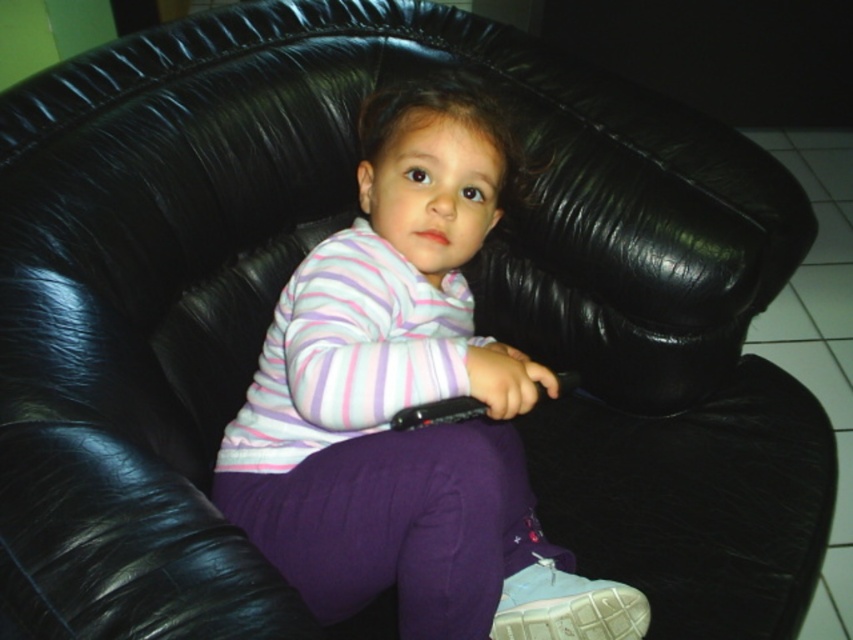
Which is more to the right, striped cotton shirt at center or light blue fabric shoe at lower center?

light blue fabric shoe at lower center

Between striped cotton shirt at center and light blue fabric shoe at lower center, which one has less height?

light blue fabric shoe at lower center is shorter.

You are a GUI agent. You are given a task and a screenshot of the screen. Output one action in this format:
    pyautogui.click(x=<x>, y=<y>)
    Task: Click on the striped cotton shirt at center
    The height and width of the screenshot is (640, 853).
    Given the screenshot: What is the action you would take?
    pyautogui.click(x=401, y=397)